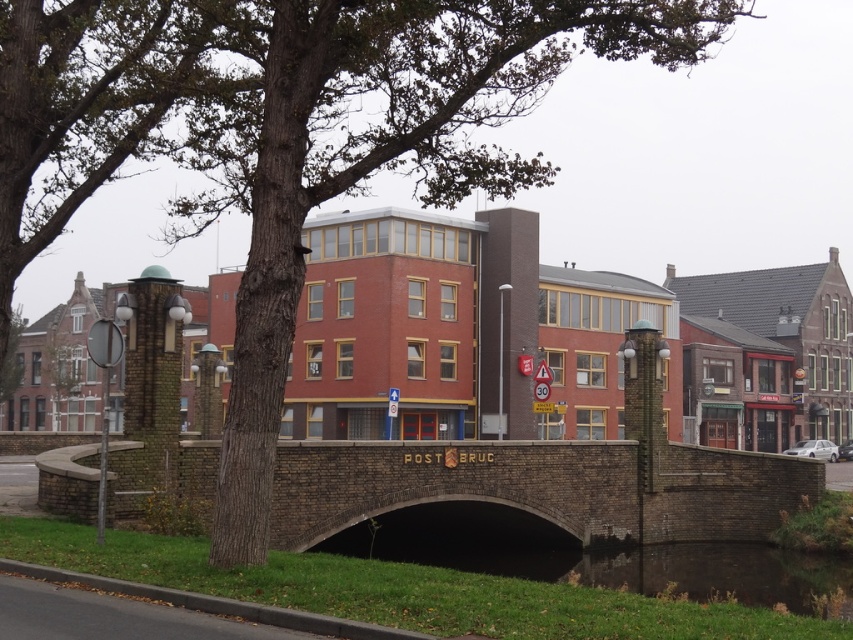
Between brown stone bridge at center and dark green grass at lower center, which one is positioned higher?

brown stone bridge at center is higher up.

Which is below, brown stone bridge at center or dark green grass at lower center?

Positioned lower is dark green grass at lower center.

Does point (555, 460) lie in front of point (347, 531)?

No, it is not.

Identify the location of brown stone bridge at center. The height and width of the screenshot is (640, 853). (550, 480).